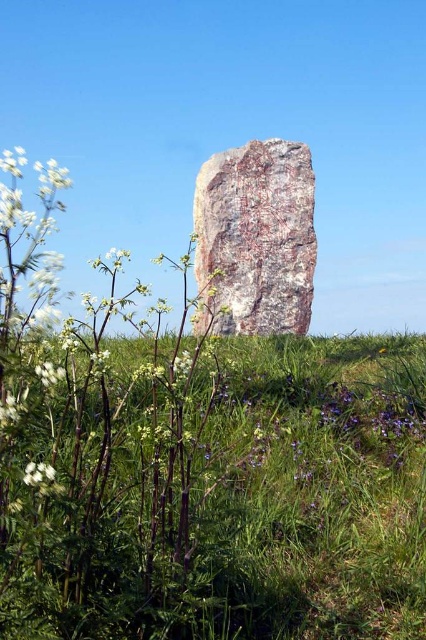
Question: Where is green grass at center located in relation to rusty stone at center in the image?

Choices:
 (A) left
 (B) right

Answer: (B)

Question: Is green grass at center bigger than rusty stone at center?

Choices:
 (A) no
 (B) yes

Answer: (B)

Question: Among these points, which one is nearest to the camera?

Choices:
 (A) (43, 547)
 (B) (271, 248)

Answer: (A)

Question: Is green grass at center smaller than rusty stone at center?

Choices:
 (A) no
 (B) yes

Answer: (A)

Question: Which of the following is the farthest from the observer?

Choices:
 (A) (270, 154)
 (B) (111, 561)

Answer: (A)